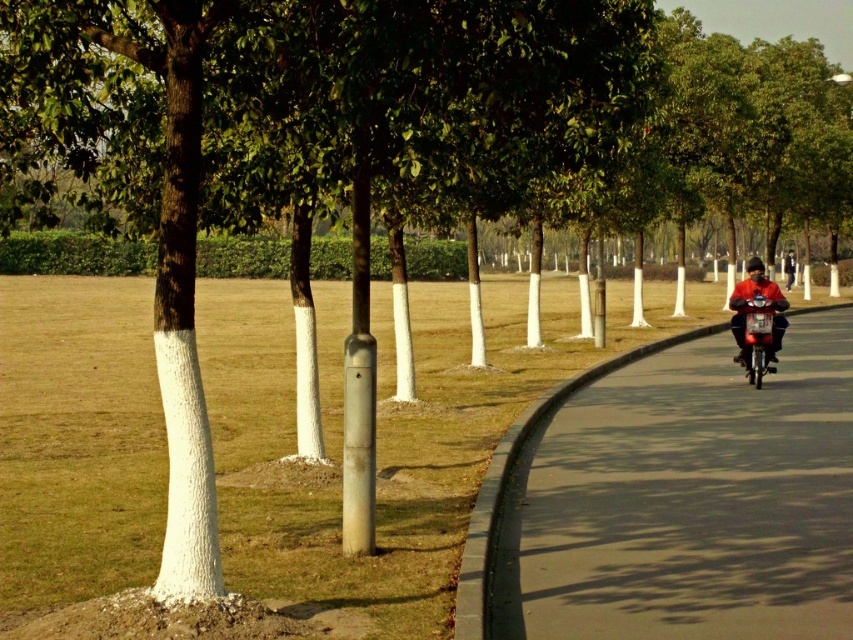
You are a hiker walking along the pathway and notice both the smooth asphalt road at right and the red matte jacket at right. Which object occupies more space in the scene?

The smooth asphalt road at right is larger in size than the red matte jacket at right, so it occupies more space in the scene.